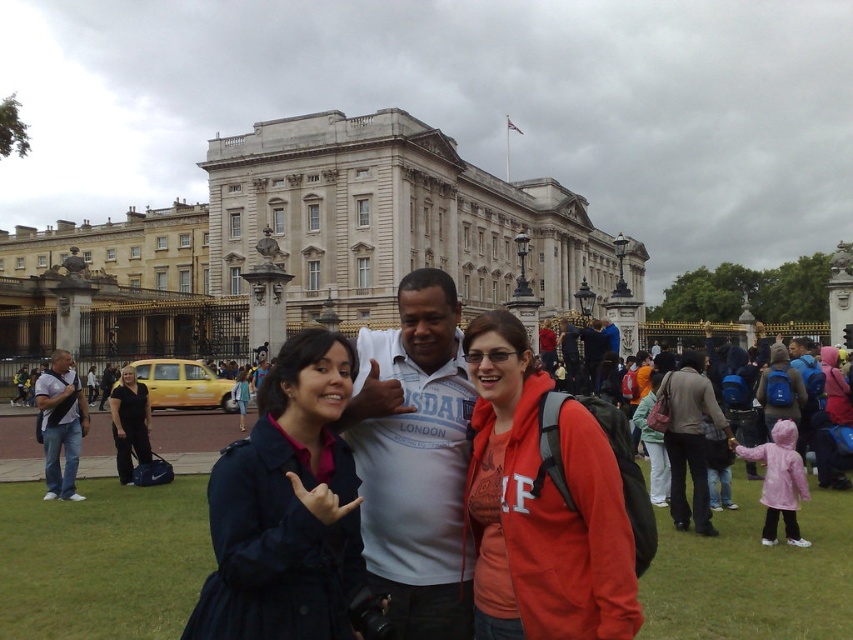
Question: Which of the following is the farthest from the observer?

Choices:
 (A) white stone building at center
 (B) black fabric jacket at lower left
 (C) white cotton shirt at center
 (D) matte white shirt at center

Answer: (A)

Question: Can you confirm if white cotton shirt at center is thinner than matte black backpack at left?

Choices:
 (A) yes
 (B) no

Answer: (A)

Question: Does white stone building at center appear over matte black backpack at left?

Choices:
 (A) no
 (B) yes

Answer: (B)

Question: Is white stone building at center smaller than matte black backpack at left?

Choices:
 (A) no
 (B) yes

Answer: (A)

Question: Which point is closer to the camera?

Choices:
 (A) (55, 368)
 (B) (630, 604)

Answer: (B)

Question: Which object is farther from the camera taking this photo?

Choices:
 (A) white cotton shirt at center
 (B) dark blue coat at center

Answer: (A)